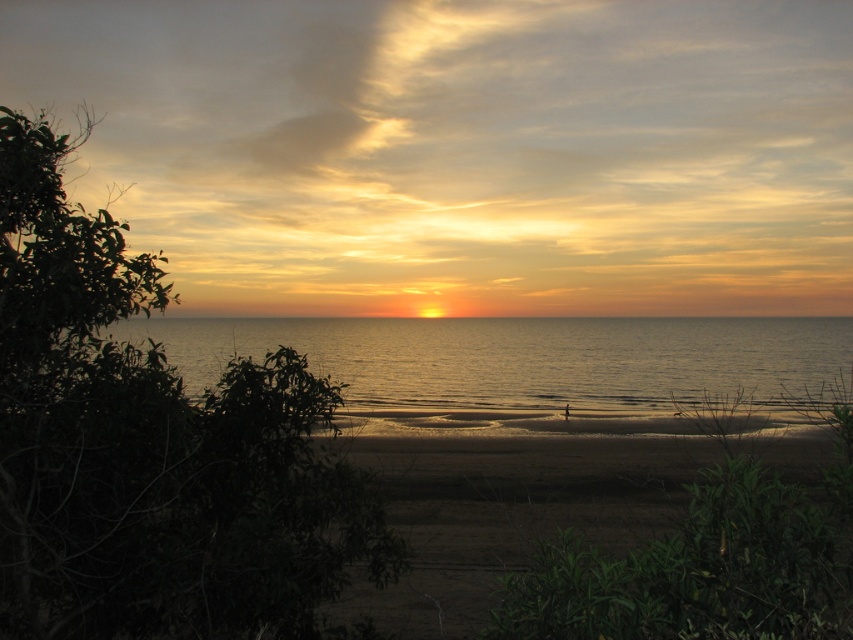
Which of these two, golden reflective water at center or brown sandy beach at center, stands taller?

With more height is golden reflective water at center.

Locate an element on the screen. golden reflective water at center is located at coordinates (524, 358).